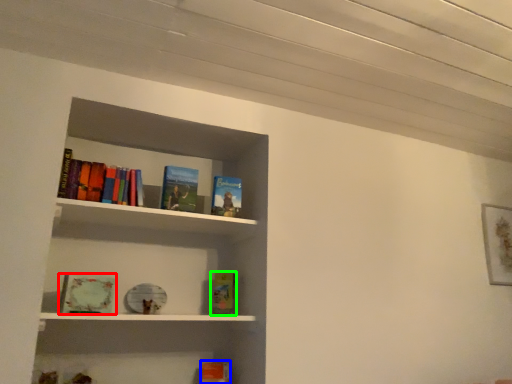
Question: Which object is positioned farthest from book (highlighted by a red box)? Select from book (highlighted by a blue box) and book (highlighted by a green box).

Choices:
 (A) book
 (B) book

Answer: (A)